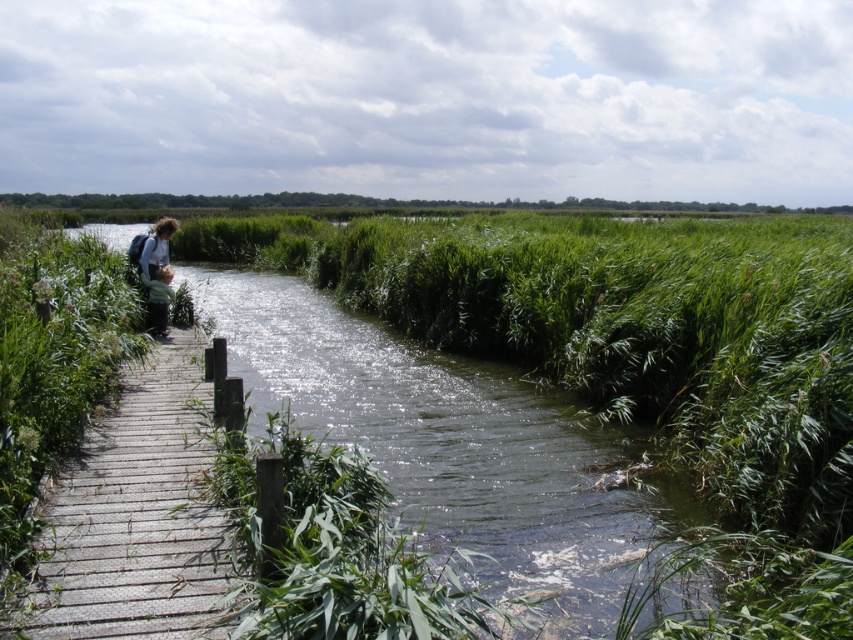
You are standing at the edge of the waterway and want to take a photo of the wooden planks at left and the light brown hair at left. Which object should you focus on first to ensure both are in sharp focus?

You should focus on the wooden planks at left first because it is closer to the viewer than the light brown hair at left, so adjusting focus starting from the closer object ensures both can be in focus.